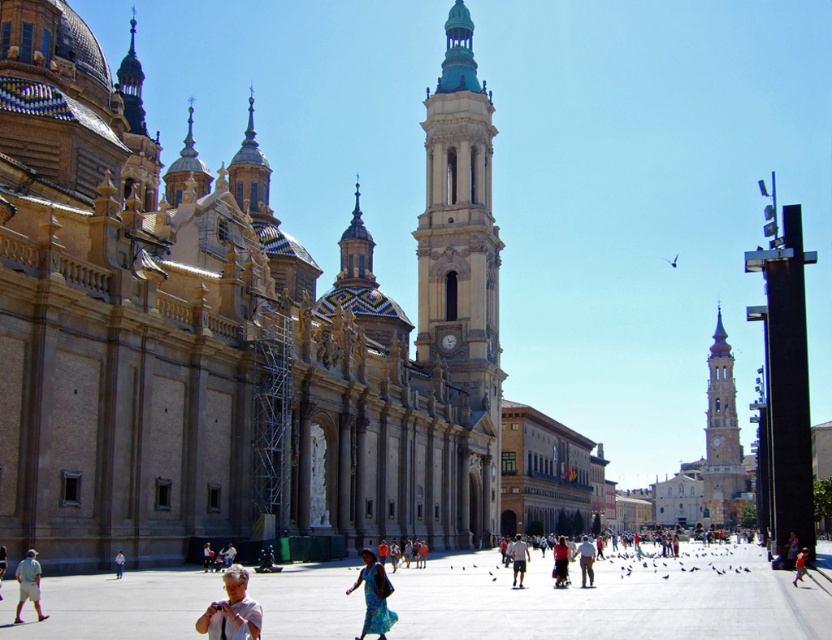
Looking at this image, which of these two, dark red fabric dress at center or red fabric jacket at center, stands shorter?

red fabric jacket at center is shorter.

Does dark red fabric dress at center have a smaller size compared to red fabric jacket at center?

Actually, dark red fabric dress at center might be larger than red fabric jacket at center.

Between point (568, 554) and point (796, 577), which one is positioned in front?

Positioned in front is point (568, 554).

I want to click on dark red fabric dress at center, so click(560, 561).

How much distance is there between smooth concrete plaza at center and smooth white tower at right?

smooth concrete plaza at center is 203.82 meters away from smooth white tower at right.

Is smooth concrete plaza at center positioned behind smooth white tower at right?

No, smooth concrete plaza at center is closer to the viewer.

Describe the element at coordinates (612, 598) in the screenshot. I see `smooth concrete plaza at center` at that location.

Where is `smooth concrete plaza at center`? smooth concrete plaza at center is located at coordinates (612, 598).

Is matte white shirt at lower center smaller than light brown shorts at center?

Indeed, matte white shirt at lower center has a smaller size compared to light brown shorts at center.

Is matte white shirt at lower center closer to camera compared to light brown shorts at center?

Yes, it is.

Image resolution: width=832 pixels, height=640 pixels. Find the location of `matte white shirt at lower center`. matte white shirt at lower center is located at coordinates (231, 611).